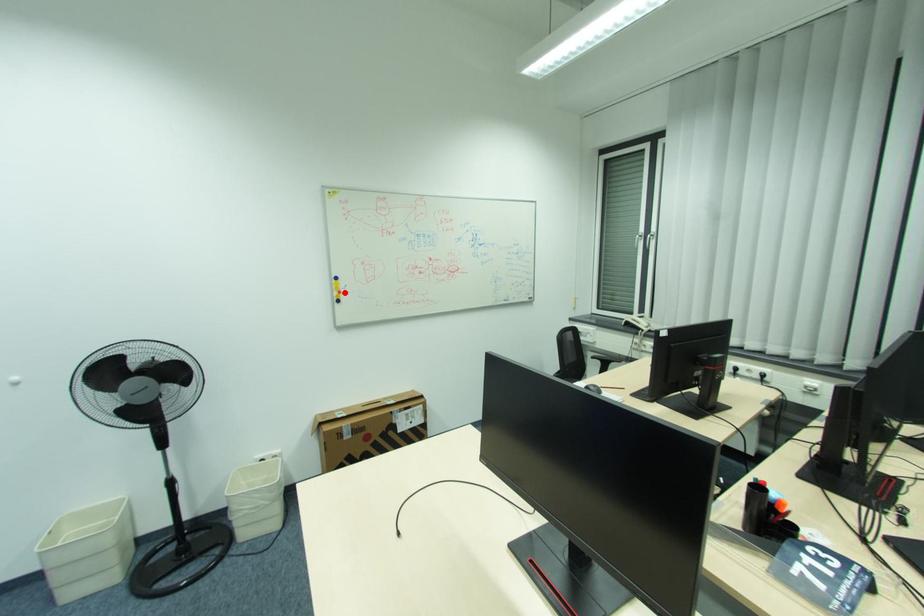
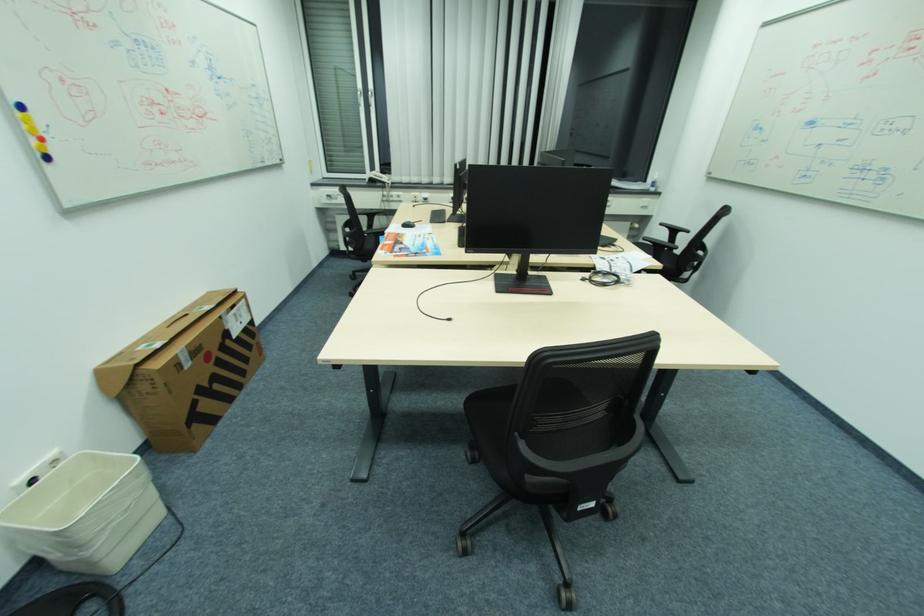
Question: I am providing you with two images of the same scene from different viewpoints. Image1 has a red point marked. In image2, the corresponding 3D location appears at what relative position? Reply with the corresponding letter.

Choices:
 (A) Closer
 (B) Farther

Answer: (B)